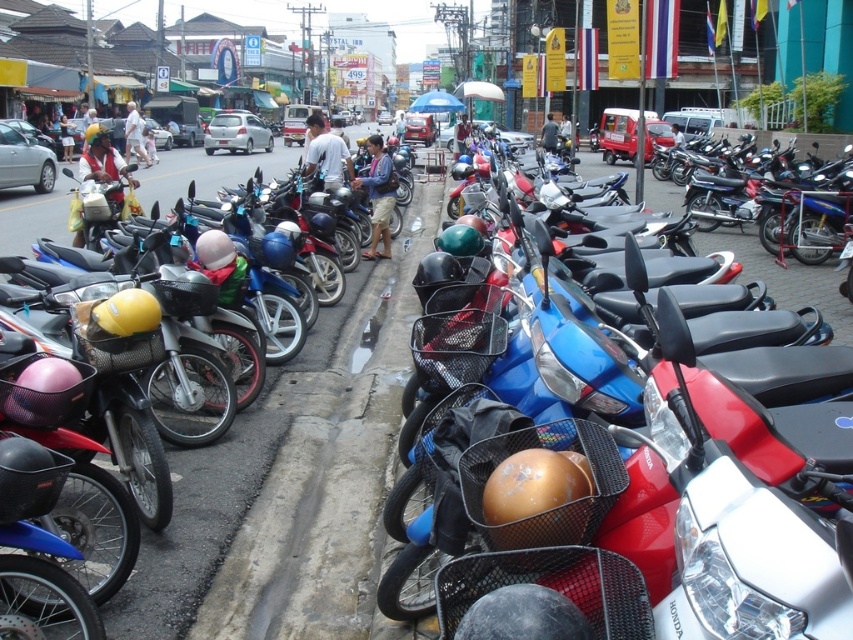
You are a delivery rider who needs to pick up a package from a locker located 5 meters away from your motorcycle. Your motorcycle is the blue glossy motorcycle at center, and the locker is near the matte blue helmet at center. Can you reach the locker without moving your motorcycle?

The blue glossy motorcycle at center is 5.17 meters from the matte blue helmet at center. Since the locker is near the matte blue helmet at center, the distance is slightly over 5 meters, so you cannot reach the locker without moving your motorcycle.

You are standing at the camera position and want to walk to both points. Which point should you reach first, point (756, 292) or point (376, 216)?

Point (756, 292) is closer to the camera than point (376, 216), so you will reach point (756, 292) first.

You are a delivery rider who needs to pick up a helmet before starting your shift. You see the blue glossy motorcycle at center and the matte blue helmet at center. Which object is positioned higher from the ground?

The blue glossy motorcycle at center is located above the matte blue helmet at center, so it is positioned higher from the ground.